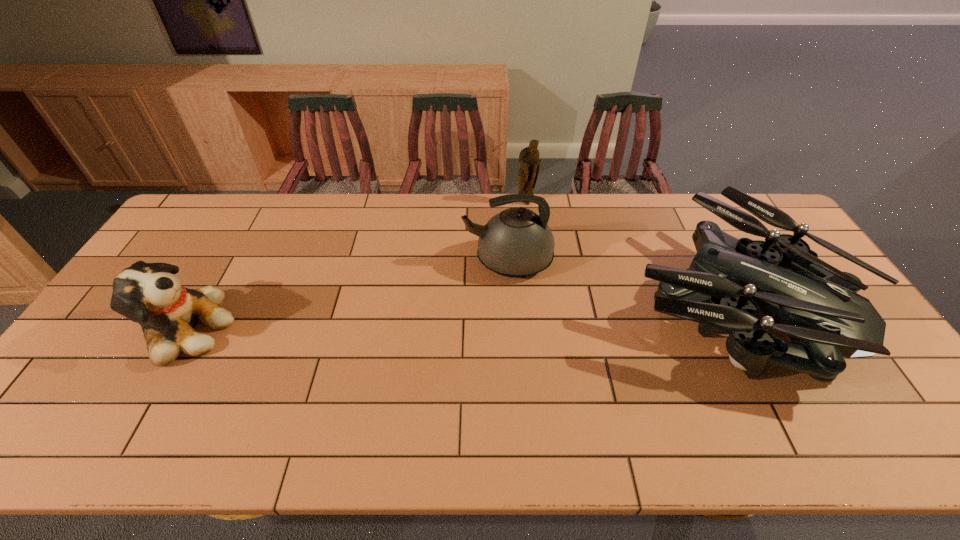
Locate an element on the screen. This screenshot has width=960, height=540. vacant space that satisfies the following two spatial constraints: 1. on the front-facing side of the farthest object; 2. at the spout of the kettle is located at coordinates (533, 261).

I want to click on vacant point that satisfies the following two spatial constraints: 1. on the front-facing side of the farthest object; 2. at the face of the puppy, so click(x=540, y=329).

Where is `free point that satisfies the following two spatial constraints: 1. on the back side of the rightmost object; 2. at the spout of the kettle`? free point that satisfies the following two spatial constraints: 1. on the back side of the rightmost object; 2. at the spout of the kettle is located at coordinates (708, 261).

Where is `vacant space that satisfies the following two spatial constraints: 1. on the front-facing side of the figurine; 2. on the right side of the rightmost object`? vacant space that satisfies the following two spatial constraints: 1. on the front-facing side of the figurine; 2. on the right side of the rightmost object is located at coordinates (538, 302).

The width and height of the screenshot is (960, 540). Find the location of `free space that satisfies the following two spatial constraints: 1. on the front-facing side of the figurine; 2. at the spout of the kettle`. free space that satisfies the following two spatial constraints: 1. on the front-facing side of the figurine; 2. at the spout of the kettle is located at coordinates (533, 261).

Find the location of a particular element. vacant region that satisfies the following two spatial constraints: 1. on the front-facing side of the farthest object; 2. on the right side of the rightmost object is located at coordinates (538, 302).

Where is `blank space that satisfies the following two spatial constraints: 1. on the front-facing side of the farthest object; 2. on the left side of the drone`? blank space that satisfies the following two spatial constraints: 1. on the front-facing side of the farthest object; 2. on the left side of the drone is located at coordinates (538, 302).

Locate an element on the screen. free location that satisfies the following two spatial constraints: 1. at the spout of the kettle; 2. on the left side of the rightmost object is located at coordinates (511, 302).